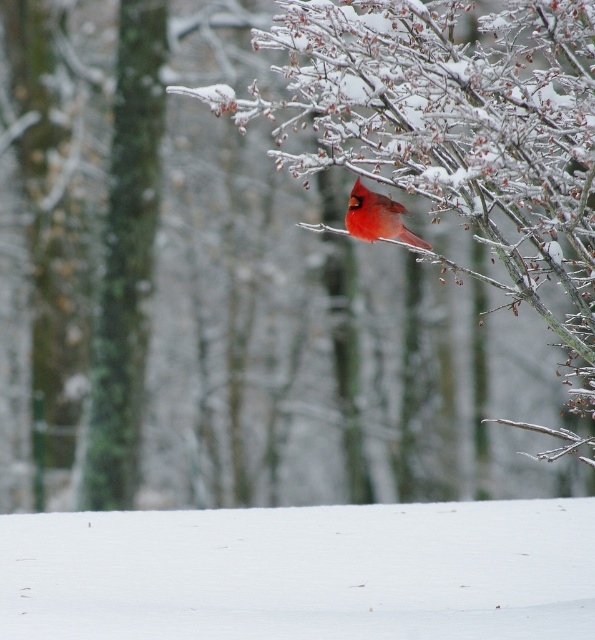
Does green mossy tree trunk at left have a greater width compared to matte red cardinal at upper center?

Correct, the width of green mossy tree trunk at left exceeds that of matte red cardinal at upper center.

What do you see at coordinates (126, 260) in the screenshot? The width and height of the screenshot is (595, 640). I see `green mossy tree trunk at left` at bounding box center [126, 260].

Which is in front, point (145, 35) or point (371, 234)?

Point (371, 234) is more forward.

The image size is (595, 640). I want to click on green mossy tree trunk at left, so click(x=126, y=260).

Is white fluffy snow at lower center to the right of green mossy tree trunk at left from the viewer's perspective?

Indeed, white fluffy snow at lower center is positioned on the right side of green mossy tree trunk at left.

Consider the image. Which is above, white fluffy snow at lower center or green mossy tree trunk at left?

green mossy tree trunk at left is above.

Image resolution: width=595 pixels, height=640 pixels. Find the location of `white fluffy snow at lower center`. white fluffy snow at lower center is located at coordinates (302, 572).

Is white fluffy snow at lower center closer to camera compared to matte red cardinal at upper center?

Yes, it is.

Looking at this image, does white fluffy snow at lower center appear on the left side of matte red cardinal at upper center?

Indeed, white fluffy snow at lower center is positioned on the left side of matte red cardinal at upper center.

Is point (289, 618) positioned after point (389, 227)?

No, it is not.

Find the location of `white fluffy snow at lower center`. white fluffy snow at lower center is located at coordinates (302, 572).